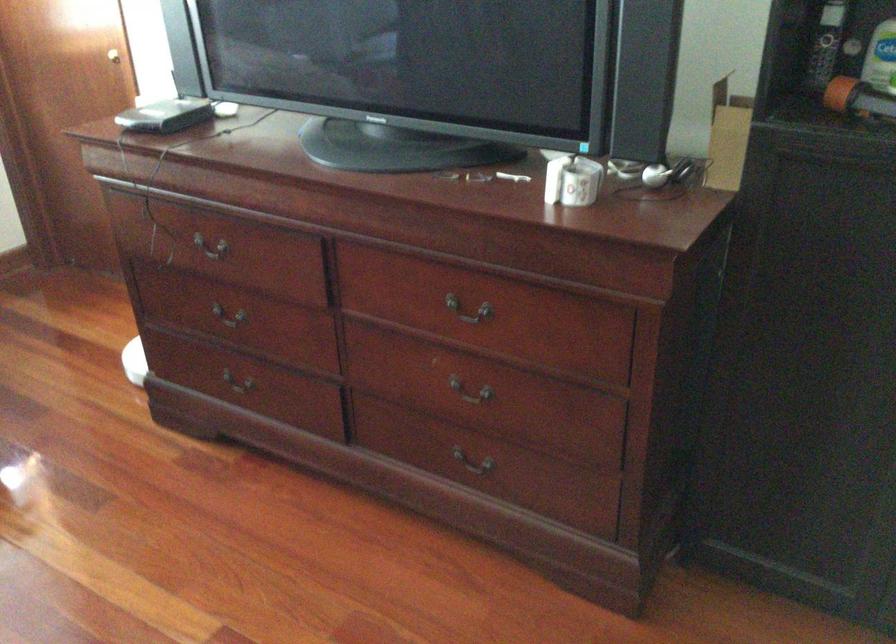
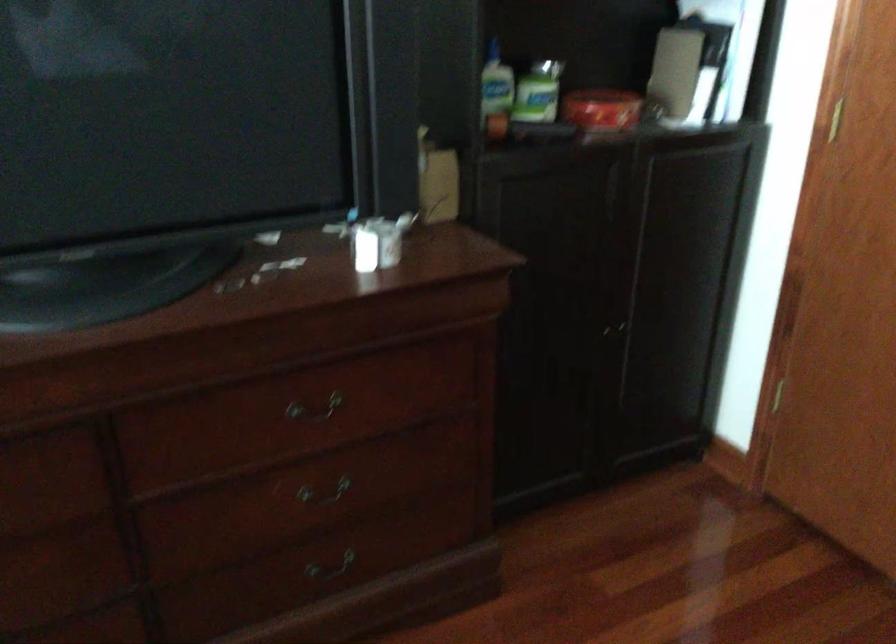
The point at (478, 469) is marked in the first image. Where is the corresponding point in the second image?

(330, 567)